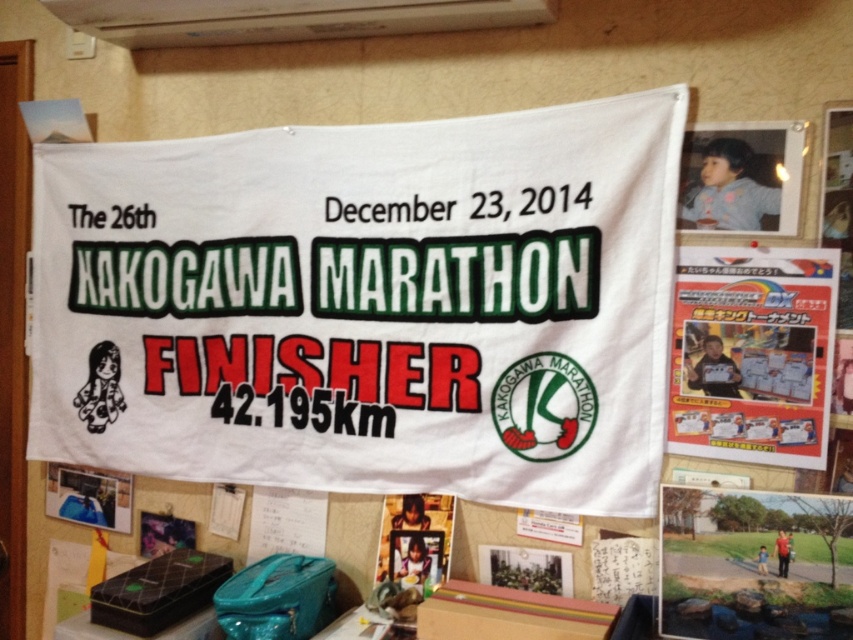
Between white fabric banner at center and matte white photo frame at center, which one is positioned lower?

matte white photo frame at center

Is white fabric banner at center shorter than matte white photo frame at center?

No.

The image size is (853, 640). Find the location of `white fabric banner at center`. white fabric banner at center is located at coordinates (367, 305).

Does white fabric banner at upper center have a greater height compared to white paper poster at center?

Yes.

Consider the image. Which is below, white fabric banner at upper center or white paper poster at center?

white paper poster at center is below.

Locate an element on the screen. This screenshot has height=640, width=853. white fabric banner at upper center is located at coordinates (753, 564).

Is the position of white paper poster at upper right more distant than that of white paper poster at center?

No, white paper poster at upper right is in front of white paper poster at center.

Does white paper poster at upper right have a larger size compared to white paper poster at center?

Correct, white paper poster at upper right is larger in size than white paper poster at center.

The width and height of the screenshot is (853, 640). I want to click on white paper poster at upper right, so click(752, 353).